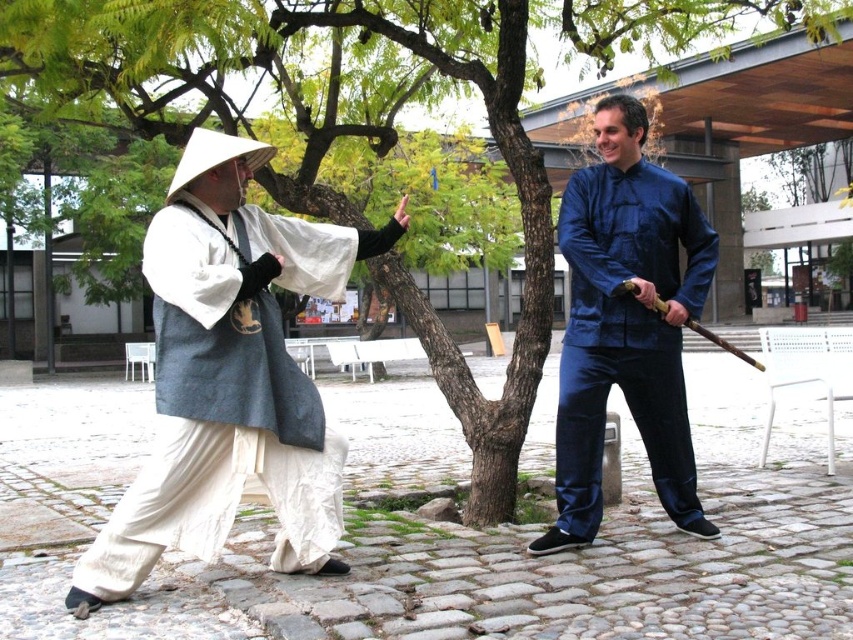
You are an observer watching a martial arts demonstration between two people wearing the white cotton robe at left and the blue silk shirt at right. Which participant is wearing a larger garment?

The white cotton robe at left is bigger than the blue silk shirt at right, so the participant wearing the white cotton robe at left is wearing a larger garment.

In the scene shown: You are a photographer standing 10 feet away from the white cotton robe at left and blue silk shirt at right. You want to capture a photo where both are in focus. Since the minimum focus distance for your camera is 5 feet, will you be able to take the photo successfully?

The distance between the white cotton robe at left and blue silk shirt at right is 4.72 feet, which is less than the camera minimum focus distance of 5 feet. Therefore, the photographer cannot take the photo successfully as the subjects are too close to each other for the camera to focus properly.

You are a costume designer preparing for a martial arts performance. You need to ensure that the costumes are visible to the audience. Given the white cotton robe at left and the blue silk shirt at right, which costume has a wider silhouette?

The white cotton robe at left has a larger width than the blue silk shirt at right, so it has a wider silhouette.